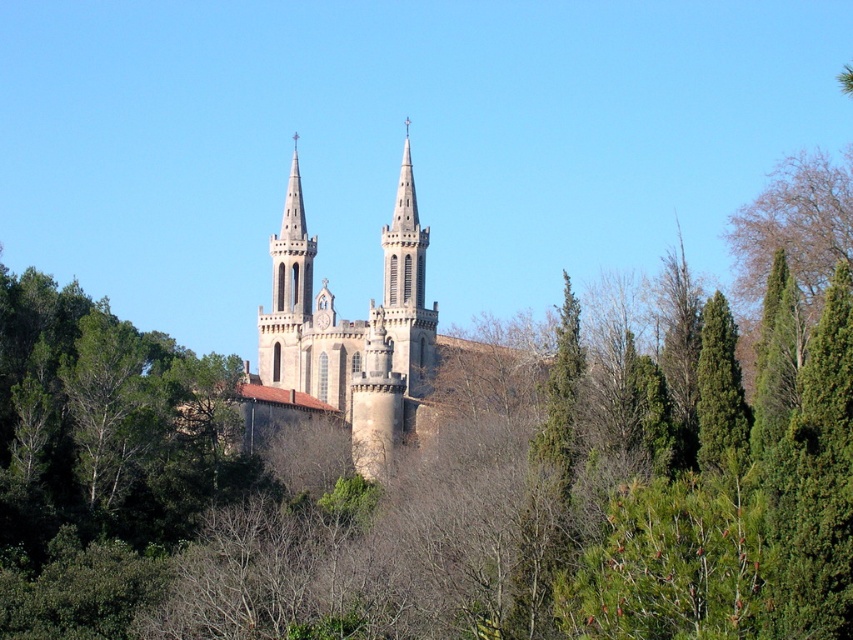
Question: Which object is the closest to the green textured pine tree at center-right?

Choices:
 (A) green coniferous tree at right
 (B) stone church at center

Answer: (A)

Question: Which point is closer to the camera?

Choices:
 (A) stone church at center
 (B) green textured pine tree at center-right
 (C) green coniferous tree at right

Answer: (C)

Question: Considering the relative positions of stone church at center and green coniferous tree at right in the image provided, where is stone church at center located with respect to green coniferous tree at right?

Choices:
 (A) left
 (B) right

Answer: (A)

Question: Can you confirm if stone church at center is positioned to the left of green coniferous tree at right?

Choices:
 (A) no
 (B) yes

Answer: (B)

Question: Based on their relative distances, which object is farther from the green textured pine tree at center-right?

Choices:
 (A) green coniferous tree at right
 (B) stone church at center

Answer: (B)

Question: Does green coniferous tree at right appear on the left side of green textured pine tree at center-right?

Choices:
 (A) no
 (B) yes

Answer: (A)